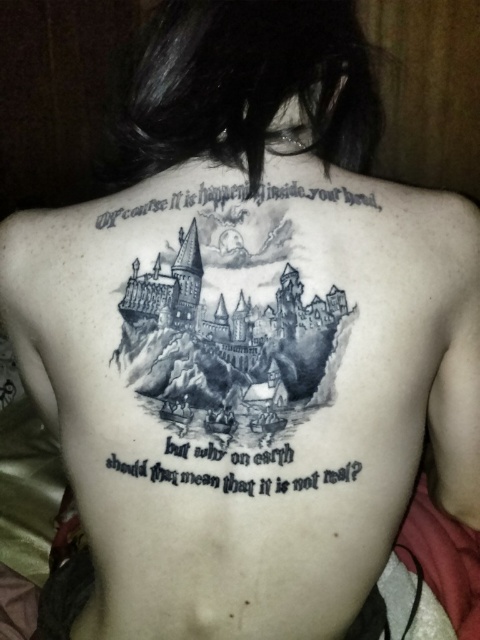
Question: Is black ink text at center positioned behind black ink text at upper center?

Choices:
 (A) no
 (B) yes

Answer: (A)

Question: Is black ink text at center below black ink text at upper center?

Choices:
 (A) no
 (B) yes

Answer: (B)

Question: Does black ink text at center have a smaller size compared to black ink text at upper center?

Choices:
 (A) yes
 (B) no

Answer: (A)

Question: Among these points, which one is farthest from the camera?

Choices:
 (A) (118, 456)
 (B) (327, 193)

Answer: (B)